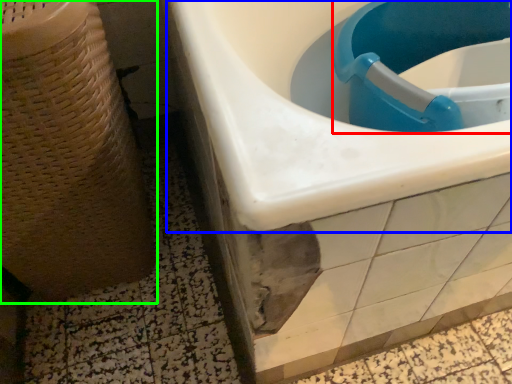
Question: Estimate the real-world distances between objects in this image. Which object is farther from sink (highlighted by a red box), sink (highlighted by a blue box) or potty (highlighted by a green box)?

Choices:
 (A) sink
 (B) potty

Answer: (B)